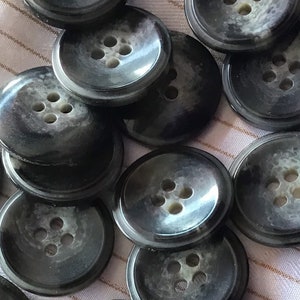
This screenshot has height=300, width=300. What are the coordinates of `light button section` in the screenshot? It's located at (55, 105), (112, 49), (171, 195), (184, 272), (66, 222).